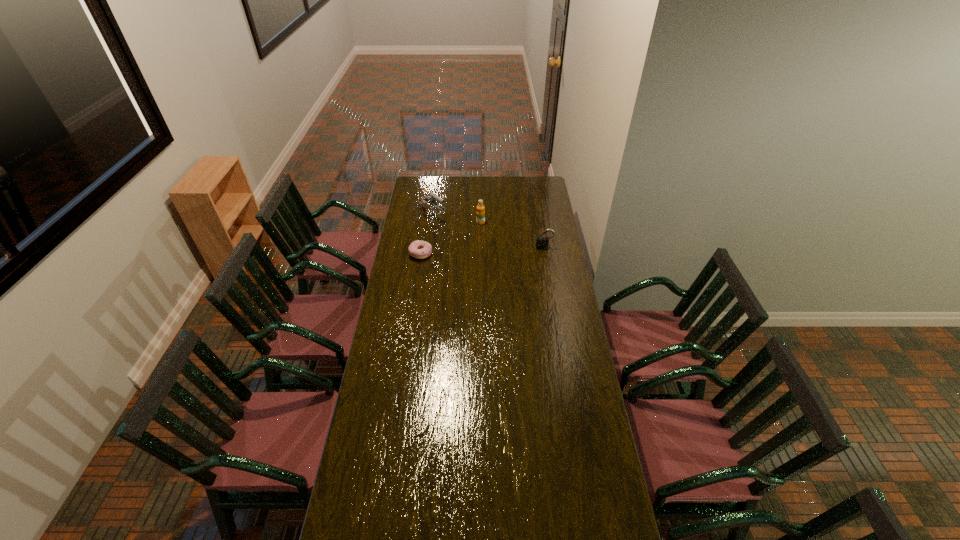
Identify the location of vacant space situated 0.180m on the label of the orange juice. tap(482, 244).

Find the location of `free space located 0.270m on the label of the orange juice`. free space located 0.270m on the label of the orange juice is located at coordinates (482, 254).

Locate an element on the screen. Image resolution: width=960 pixels, height=540 pixels. free space located 0.130m on the label of the orange juice is located at coordinates (482, 239).

Image resolution: width=960 pixels, height=540 pixels. What are the coordinates of `doughnut that is at the left edge` in the screenshot? It's located at (418, 249).

What are the coordinates of `gun at the left edge` in the screenshot? It's located at (431, 198).

Find the location of a particular element. The height and width of the screenshot is (540, 960). object at the right edge is located at coordinates (542, 242).

Find the location of a particular element. This screenshot has height=540, width=960. vacant region at the far edge of the desktop is located at coordinates (514, 189).

The width and height of the screenshot is (960, 540). Identify the location of free point at the near edge. (458, 510).

In the image, there is a desktop. Identify the location of blank space at the left edge. (426, 206).

Find the location of a particular element. The height and width of the screenshot is (540, 960). vacant area at the right edge of the desktop is located at coordinates (552, 252).